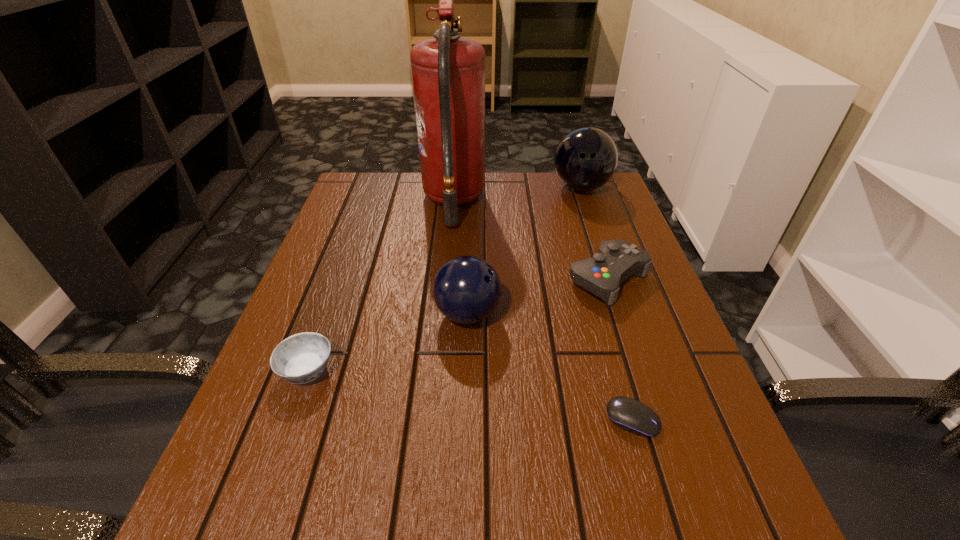
This screenshot has height=540, width=960. I want to click on control that is at the right edge, so click(x=616, y=260).

I want to click on computer mouse situated at the right edge, so click(x=627, y=413).

I want to click on object present at the far right corner, so click(x=585, y=159).

In order to click on vacant space at the far edge of the desktop in this screenshot , I will do `click(483, 207)`.

Where is `free region at the near edge of the desktop`? This screenshot has width=960, height=540. free region at the near edge of the desktop is located at coordinates (591, 514).

Identify the location of free spot at the left edge of the desktop. (321, 410).

Locate an element on the screen. The height and width of the screenshot is (540, 960). free spot at the right edge of the desktop is located at coordinates (705, 422).

Identify the location of free spot at the far left corner of the desktop. This screenshot has width=960, height=540. (389, 210).

Image resolution: width=960 pixels, height=540 pixels. What are the coordinates of `vacant space at the far right corner of the desktop` in the screenshot? It's located at (602, 193).

The height and width of the screenshot is (540, 960). In order to click on blank region between the shorter bowling ball and the fifth shortest object in this screenshot , I will do `click(524, 251)`.